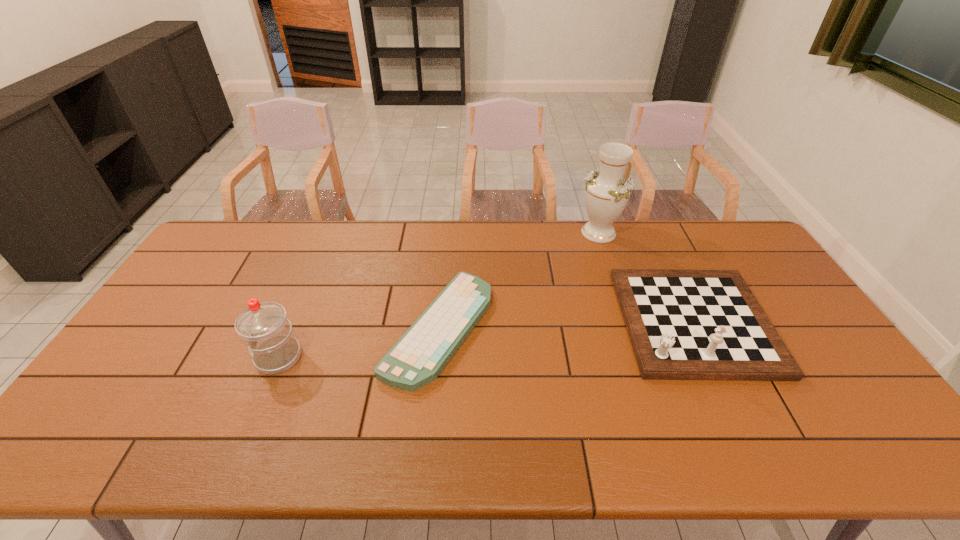
Where is `free spot located 0.320m on the handle side of the third shortest object`? The height and width of the screenshot is (540, 960). free spot located 0.320m on the handle side of the third shortest object is located at coordinates (138, 357).

Where is `vacant area situated 0.200m on the left of the second shortest object`? The height and width of the screenshot is (540, 960). vacant area situated 0.200m on the left of the second shortest object is located at coordinates (555, 322).

The image size is (960, 540). I want to click on free location located 0.130m on the left of the second object from left to right, so click(341, 328).

You are a GUI agent. You are given a task and a screenshot of the screen. Output one action in this format:
    pyautogui.click(x=<x>, y=<y>)
    Task: Click on the object present at the far edge
    This screenshot has width=960, height=540.
    Given the screenshot: What is the action you would take?
    pyautogui.click(x=607, y=192)

Find the location of a particular element. object that is positioned at the right edge is located at coordinates (683, 324).

Find the location of a particular element. The image size is (960, 540). free location at the far edge is located at coordinates (542, 235).

Find the location of a particular element. The height and width of the screenshot is (540, 960). blank space at the near edge is located at coordinates (631, 451).

In the image, there is a desktop. At what (x,y) coordinates should I click in order to perform the action: click on vacant space at the left edge. Please return your answer as a coordinate pair (x, y). Looking at the image, I should click on (173, 290).

In the image, there is a desktop. Where is `vacant space at the right edge`? The width and height of the screenshot is (960, 540). vacant space at the right edge is located at coordinates (854, 424).

In the image, there is a desktop. Where is `vacant space at the far left corner`? The image size is (960, 540). vacant space at the far left corner is located at coordinates (252, 235).